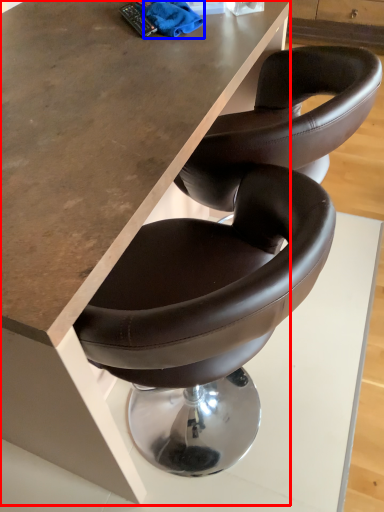
Question: Which point is closer to the camera, table (highlighted by a red box) or material (highlighted by a blue box)?

Choices:
 (A) table
 (B) material

Answer: (A)